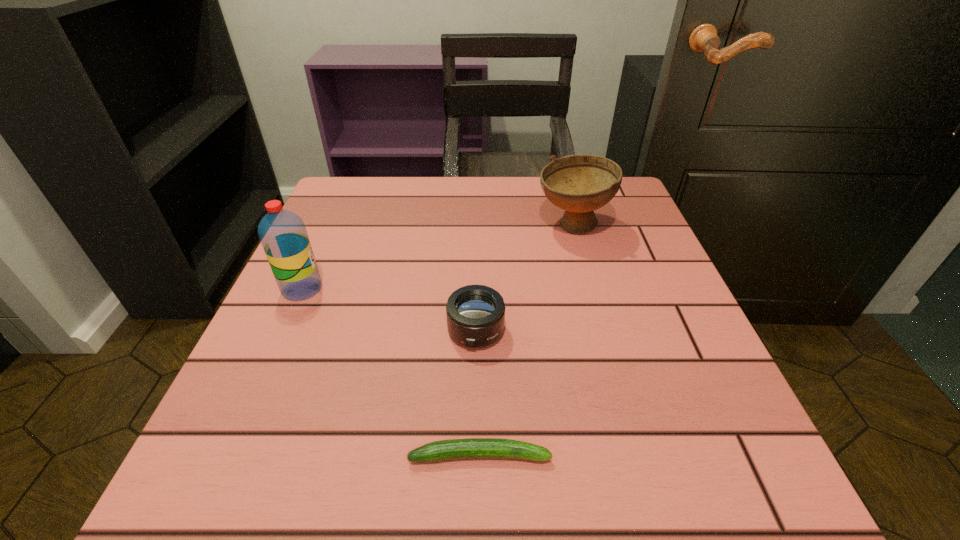
In the image, there is a desktop. At what (x,y) coordinates should I click in order to perform the action: click on vacant space at the far left corner. Please return your answer as a coordinate pair (x, y). Image resolution: width=960 pixels, height=540 pixels. Looking at the image, I should click on (347, 194).

The image size is (960, 540). In order to click on vacant space that's between the leftmost object and the nearest object in this screenshot , I will do `click(391, 372)`.

Where is `unoccupied area between the third shortest object and the water bottle`? The image size is (960, 540). unoccupied area between the third shortest object and the water bottle is located at coordinates (437, 257).

You are a GUI agent. You are given a task and a screenshot of the screen. Output one action in this format:
    pyautogui.click(x=<x>, y=<y>)
    Task: Click on the free point between the tallest object and the rightmost object
    The height and width of the screenshot is (540, 960).
    Given the screenshot: What is the action you would take?
    pyautogui.click(x=437, y=257)

Identify the location of free point between the shortest object and the tallest object. The height and width of the screenshot is (540, 960). (391, 372).

The height and width of the screenshot is (540, 960). I want to click on free spot between the third farthest object and the farthest object, so click(524, 279).

Identify the location of free space that is in between the nearest object and the water bottle. This screenshot has width=960, height=540. (391, 372).

This screenshot has width=960, height=540. Identify the location of free space between the shortest object and the tallest object. (391, 372).

Locate an element on the screen. Image resolution: width=960 pixels, height=540 pixels. unoccupied area between the zucchini and the soup bowl is located at coordinates (x=526, y=341).

Find the location of a particular element. free space that is in between the water bottle and the rightmost object is located at coordinates (437, 257).